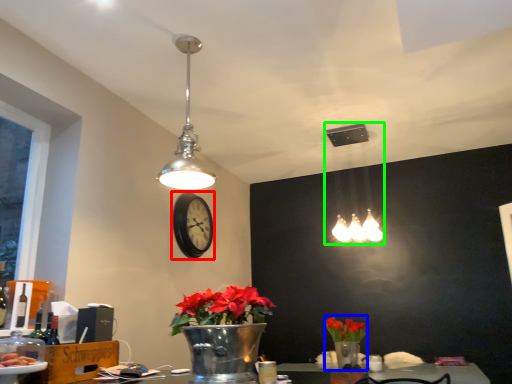
Question: Which object is the farthest from clock (highlighted by a red box)? Choose among these: floral arrangement (highlighted by a blue box) or lamp (highlighted by a green box).

Choices:
 (A) floral arrangement
 (B) lamp

Answer: (B)